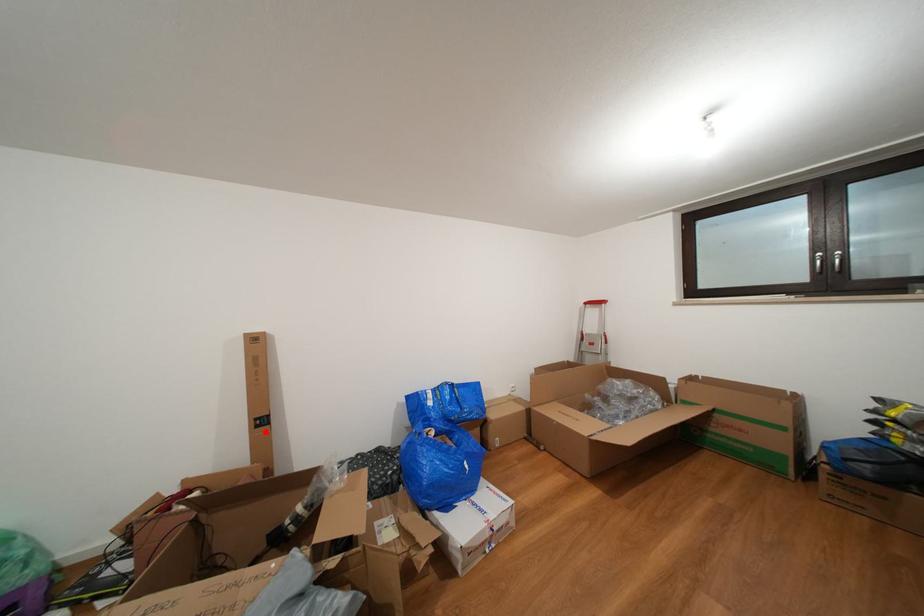
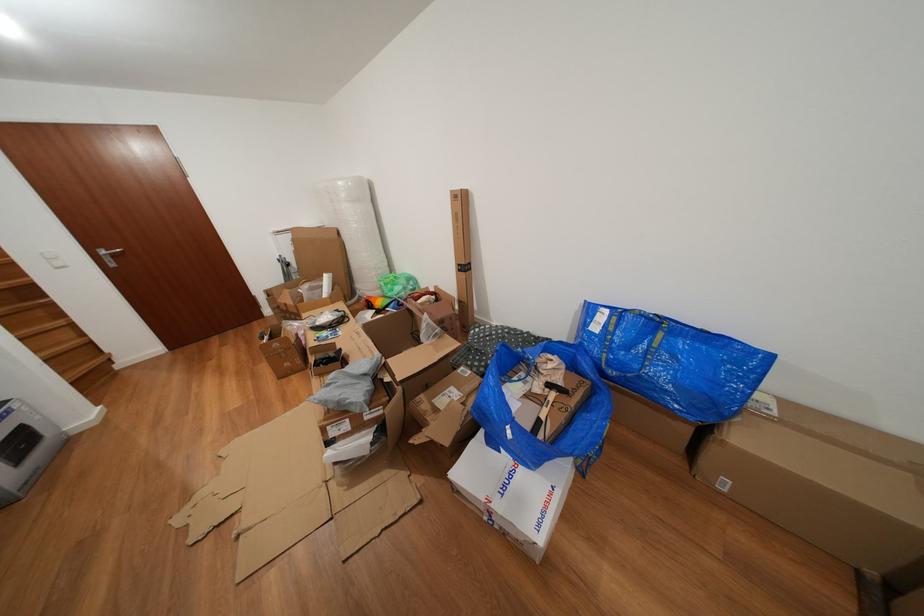
Find the pixel in the second image that matches the highlighted location in the first image.

(468, 276)